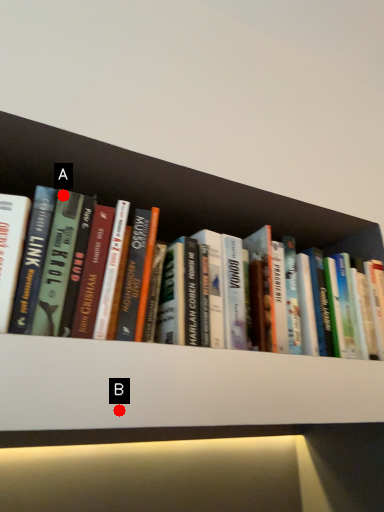
Question: Two points are circled on the image, labeled by A and B beside each circle. Among these points, which one is farthest from the camera?

Choices:
 (A) A is further
 (B) B is further

Answer: (A)